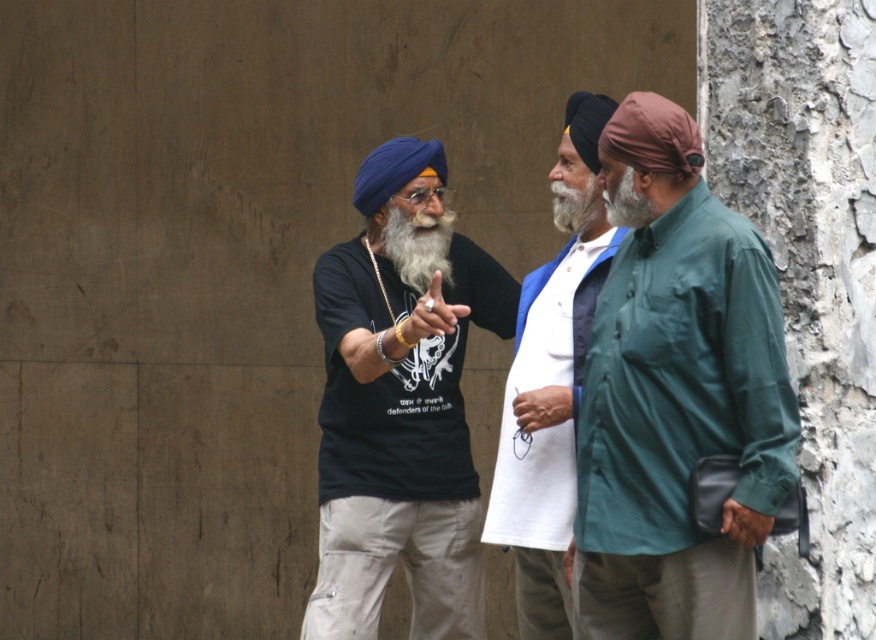
Consider the image. You are standing 5 meters away from the textured wall where the three men are standing. You want to take a photo of the green fabric shirt at right. Can you reach the shirt within 5 meters to take the photo?

The green fabric shirt at right is 4.72 meters away from the viewer, so yes, you can reach it within 5 meters to take the photo.

Based on the photo, you are a photographer trying to capture a closeup of the man on the left. You have a zoom lens that can focus on objects within a 0.5 unit distance from the camera. The man on the left has a point at coordinates point (592, 388) and the man in the middle has a point at point (431, 273). Which of these points is within the focus range of your lens?

Point (592, 388) is closer to the camera than point (431, 273), so it is within the 0.5 unit focus range of the lens.